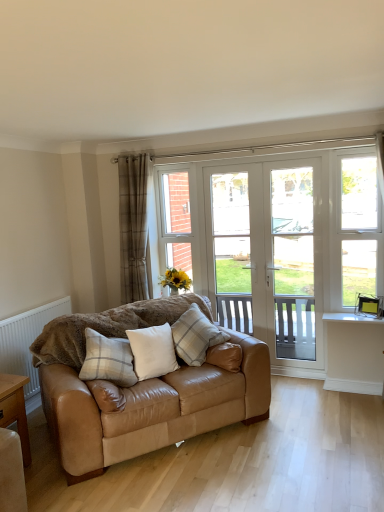
What do you see at coordinates (175, 280) in the screenshot?
I see `yellow matte vase at center` at bounding box center [175, 280].

The image size is (384, 512). Describe the element at coordinates (108, 360) in the screenshot. I see `plaid fabric pillow at center, arranged as the third pillow when viewed from the right` at that location.

The image size is (384, 512). What do you see at coordinates (27, 340) in the screenshot?
I see `white textured radiator at lower left` at bounding box center [27, 340].

What is the approximate height of light brown wooden table at lower left?

The height of light brown wooden table at lower left is 24.17 inches.

Measure the distance between plaid fabric curtain at left and camera.

plaid fabric curtain at left and camera are 12.77 feet apart from each other.

What do you see at coordinates (150, 408) in the screenshot? Image resolution: width=384 pixels, height=512 pixels. I see `tan leather couch at center` at bounding box center [150, 408].

Locate an element on the screen. yellow matte vase at center is located at coordinates (175, 280).

Does white plastic screen door at center, the first screen door when ordered from right to left, appear on the right side of plaid fabric pillow at center, the first pillow viewed from the right?

Correct, you'll find white plastic screen door at center, the first screen door when ordered from right to left, to the right of plaid fabric pillow at center, the first pillow viewed from the right.

Between white plastic screen door at center, the first screen door when ordered from right to left, and plaid fabric pillow at center, positioned as the 3th pillow in left-to-right order, which one has smaller size?

plaid fabric pillow at center, positioned as the 3th pillow in left-to-right order, is smaller.

Is point (301, 240) more distant than point (217, 328)?

Yes.

Does white leather pillow at center, positioned as the second pillow in right-to-left order, have a larger size compared to plaid fabric pillow at center, which is the 1th pillow in left-to-right order?

No, white leather pillow at center, positioned as the second pillow in right-to-left order, is not bigger than plaid fabric pillow at center, which is the 1th pillow in left-to-right order.

Is white leather pillow at center, positioned as the second pillow in right-to-left order, facing towards plaid fabric pillow at center, which is the 1th pillow in left-to-right order?

No, white leather pillow at center, positioned as the second pillow in right-to-left order, is not facing towards plaid fabric pillow at center, which is the 1th pillow in left-to-right order.

Is white leather pillow at center, positioned as the second pillow in right-to-left order, far from plaid fabric pillow at center, which is the 1th pillow in left-to-right order?

No, white leather pillow at center, positioned as the second pillow in right-to-left order, is not far from plaid fabric pillow at center, which is the 1th pillow in left-to-right order.

Is yellow matte vase at center oriented away from plaid fabric pillow at center, the first pillow viewed from the right?

yellow matte vase at center does not have its back to plaid fabric pillow at center, the first pillow viewed from the right.

Can you confirm if yellow matte vase at center is positioned to the left of plaid fabric pillow at center, the first pillow viewed from the right?

Correct, you'll find yellow matte vase at center to the left of plaid fabric pillow at center, the first pillow viewed from the right.

Considering the relative sizes of yellow matte vase at center and plaid fabric pillow at center, positioned as the 3th pillow in left-to-right order, in the image provided, is yellow matte vase at center thinner than plaid fabric pillow at center, positioned as the 3th pillow in left-to-right order,?

Yes.

Looking at this image, from a real-world perspective, is yellow matte vase at center physically below plaid fabric pillow at center, positioned as the 3th pillow in left-to-right order?

No, from a real-world perspective, yellow matte vase at center is not beneath plaid fabric pillow at center, positioned as the 3th pillow in left-to-right order.

Is yellow matte vase at center at the back of white plastic window at center?

Yes, yellow matte vase at center is at the back of white plastic window at center.

Between white plastic window at center and yellow matte vase at center, which one has less height?

With less height is yellow matte vase at center.

From a real-world perspective, between white plastic window at center and yellow matte vase at center, who is vertically higher?

From a 3D spatial view, white plastic window at center is above.

Does white plastic window at center have a smaller size compared to yellow matte vase at center?

No, white plastic window at center is not smaller than yellow matte vase at center.

Does white leather pillow at center, positioned as the second pillow in right-to-left order, have a lesser height compared to white plastic screen door at center, the first screen door when ordered from right to left?

Yes.

Looking at their sizes, would you say white leather pillow at center, positioned as the second pillow in right-to-left order, is wider or thinner than white plastic screen door at center, the first screen door when ordered from right to left?

In the image, white leather pillow at center, positioned as the second pillow in right-to-left order, appears to be wider than white plastic screen door at center, the first screen door when ordered from right to left.

From the image's perspective, is white leather pillow at center, the 2th pillow positioned from the left, on top of white plastic screen door at center, the 2th screen door viewed from the left?

No, from the image's perspective, white leather pillow at center, the 2th pillow positioned from the left, is not above white plastic screen door at center, the 2th screen door viewed from the left.

Considering the positions of objects white leather pillow at center, positioned as the second pillow in right-to-left order, and white plastic window at center in the image provided, who is more to the right, white leather pillow at center, positioned as the second pillow in right-to-left order, or white plastic window at center?

From the viewer's perspective, white plastic window at center appears more on the right side.

Is white leather pillow at center, positioned as the second pillow in right-to-left order, oriented away from white plastic window at center?

No.

Considering the sizes of white leather pillow at center, positioned as the second pillow in right-to-left order, and white plastic window at center in the image, is white leather pillow at center, positioned as the second pillow in right-to-left order, bigger or smaller than white plastic window at center?

Clearly, white leather pillow at center, positioned as the second pillow in right-to-left order, is smaller in size than white plastic window at center.

How different are the orientations of white leather pillow at center, the 2th pillow positioned from the left, and white plastic window at center in degrees?

The angle between the facing direction of white leather pillow at center, the 2th pillow positioned from the left, and the facing direction of white plastic window at center is 52.2 degrees.

In the scene shown: Is white textured radiator at lower left inside white plastic screen door at center, the 2th screen door viewed from the left?

No, white textured radiator at lower left is not a part of white plastic screen door at center, the 2th screen door viewed from the left.

How different are the orientations of white plastic screen door at center, the 2th screen door viewed from the left, and white textured radiator at lower left in degrees?

90.1 degrees.

Is white plastic screen door at center, the first screen door when ordered from right to left, positioned far away from white textured radiator at lower left?

Yes.

The width and height of the screenshot is (384, 512). There is a white plastic screen door at center, the 2th screen door viewed from the left. Find the location of `the 1st pillow below it (from a real-world perspective)`. the 1st pillow below it (from a real-world perspective) is located at coordinates (195, 336).

Identify the location of the 1st pillow counting from the right of the plaid fabric pillow at center, which is the 1th pillow in left-to-right order. Image resolution: width=384 pixels, height=512 pixels. (152, 351).

Estimate the real-world distances between objects in this image. Which object is further from white leather pillow at center, the 2th pillow positioned from the left, white plastic window at right or plaid fabric curtain at left?

white plastic window at right is further to white leather pillow at center, the 2th pillow positioned from the left.

From the image, which object appears to be nearer to plaid fabric curtain at left, plaid fabric pillow at center, arranged as the third pillow when viewed from the right, or white leather pillow at center, positioned as the second pillow in right-to-left order?

Among the two, white leather pillow at center, positioned as the second pillow in right-to-left order, is located nearer to plaid fabric curtain at left.

Considering their positions, is white glass screen door at center, positioned as the first screen door in left-to-right order, positioned further to white plastic window at right than yellow matte vase at center?

yellow matte vase at center is positioned further to the anchor white plastic window at right.

Based on their spatial positions, is white leather pillow at center, positioned as the second pillow in right-to-left order, or plaid fabric pillow at center, the first pillow viewed from the right, further from plaid fabric curtain at left?

white leather pillow at center, positioned as the second pillow in right-to-left order.

From the image, which object appears to be nearer to light brown wooden table at lower left, white textured radiator at lower left or white plastic window at center?

white textured radiator at lower left is closer to light brown wooden table at lower left.

Looking at the image, which one is located closer to white plastic window at center, plaid fabric pillow at center, arranged as the third pillow when viewed from the right, or yellow matte vase at center?

Among the two, yellow matte vase at center is located nearer to white plastic window at center.

Based on the photo, estimate the real-world distances between objects in this image. Which object is further from plaid fabric pillow at center, the first pillow viewed from the right, white textured radiator at lower left or white plastic window at center?

white textured radiator at lower left is further to plaid fabric pillow at center, the first pillow viewed from the right.

Consider the image. Which object lies further to the anchor point white textured radiator at lower left, plaid fabric curtain at left or white plastic window at right?

white plastic window at right is further to white textured radiator at lower left.

Image resolution: width=384 pixels, height=512 pixels. Find the location of `curtain between white plastic window at center and plaid fabric pillow at center, the first pillow viewed from the right, in the vertical direction`. curtain between white plastic window at center and plaid fabric pillow at center, the first pillow viewed from the right, in the vertical direction is located at coordinates (134, 229).

I want to click on table between tan leather couch at center and white plastic window at center from front to back, so click(15, 409).

Find the location of `pillow between white plastic window at center and white plastic screen door at center, the 2th screen door viewed from the left, in the horizontal direction`. pillow between white plastic window at center and white plastic screen door at center, the 2th screen door viewed from the left, in the horizontal direction is located at coordinates (195, 336).

Find the location of a particular element. The image size is (384, 512). flower situated between tan leather couch at center and white plastic window at right from left to right is located at coordinates (175, 280).